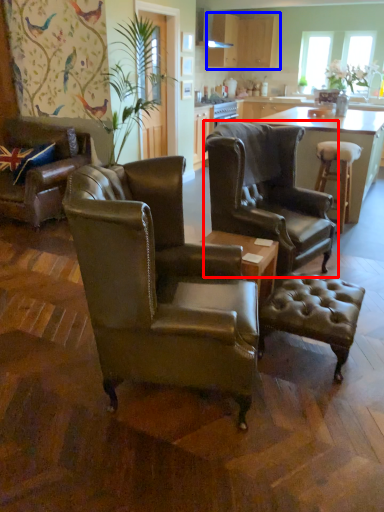
Question: Among these objects, which one is farthest to the camera, chair (highlighted by a red box) or cabinetry (highlighted by a blue box)?

Choices:
 (A) chair
 (B) cabinetry

Answer: (B)